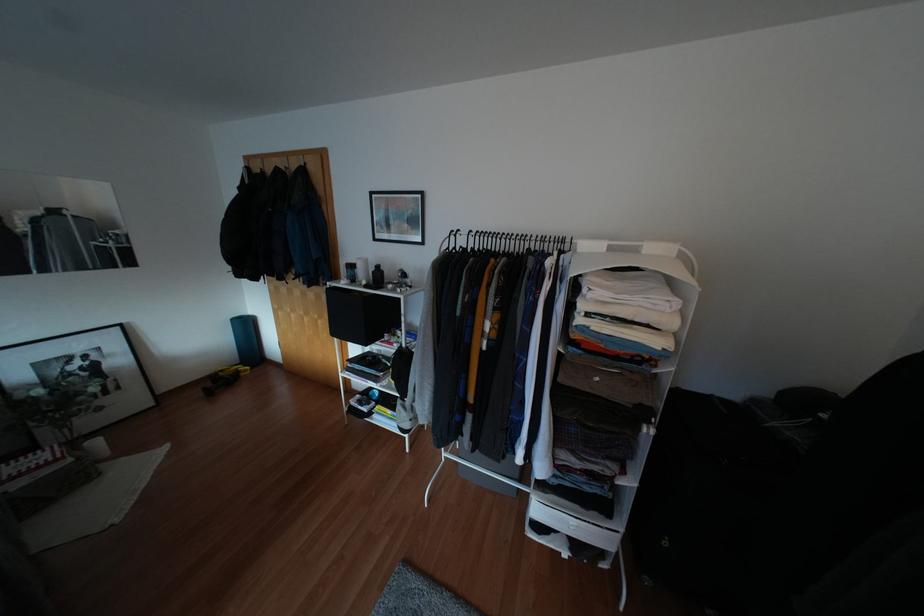
You are a GUI agent. You are given a task and a screenshot of the screen. Output one action in this format:
    pyautogui.click(x=<x>, y=<y>)
    Task: Click on the black bottle
    
    Given the screenshot: What is the action you would take?
    pyautogui.click(x=378, y=276)